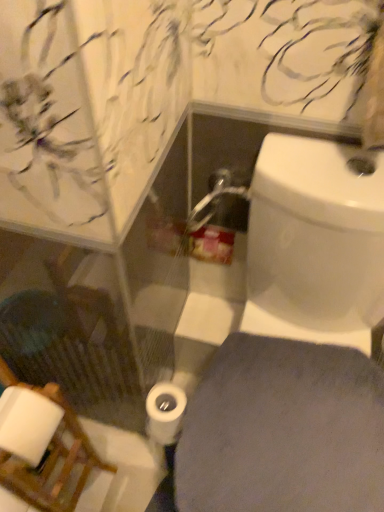
Question: In the image, is white glossy toilet at lower right positioned in front of or behind white matte toilet paper at center?

Choices:
 (A) front
 (B) behind

Answer: (A)

Question: Is white glossy toilet at lower right wider or thinner than white matte toilet paper at center?

Choices:
 (A) thin
 (B) wide

Answer: (B)

Question: Considering the real-world distances, which object is farthest from the wooden chair at lower left?

Choices:
 (A) white glossy toilet at lower right
 (B) white matte toilet paper at center

Answer: (A)

Question: Which object is positioned farthest from the white glossy toilet at lower right?

Choices:
 (A) wooden chair at lower left
 (B) white matte toilet paper at center

Answer: (A)